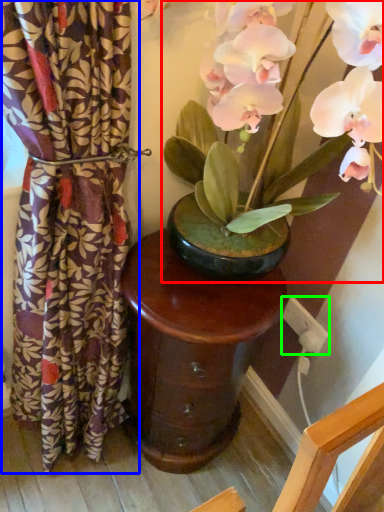
Question: Which object is positioned farthest from houseplant (highlighted by a red box)? Select from curtain (highlighted by a blue box) and electric outlet (highlighted by a green box).

Choices:
 (A) curtain
 (B) electric outlet

Answer: (B)